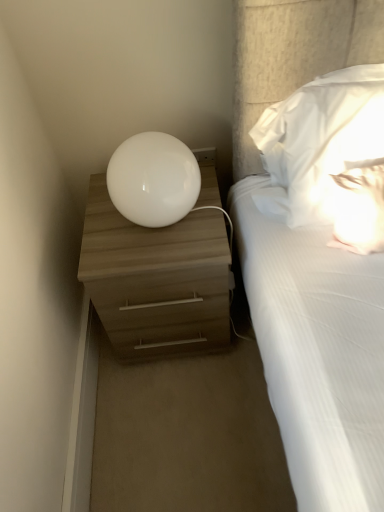
Question: Is matte wood nightstand at left situated inside white glossy sphere at upper center or outside?

Choices:
 (A) inside
 (B) outside

Answer: (B)

Question: From the image's perspective, is matte wood nightstand at left located above or below white glossy sphere at upper center?

Choices:
 (A) above
 (B) below

Answer: (B)

Question: Estimate the real-world distances between objects in this image. Which object is farther from the matte wood nightstand at left?

Choices:
 (A) white glossy sphere at upper center
 (B) white soft pillow at upper right

Answer: (B)

Question: Estimate the real-world distances between objects in this image. Which object is farther from the white soft pillow at upper right?

Choices:
 (A) matte wood nightstand at left
 (B) white glossy sphere at upper center

Answer: (A)